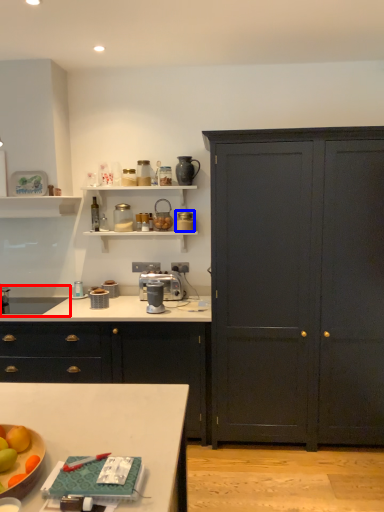
Question: Which point is further to the camera, sink (highlighted by a red box) or appliance (highlighted by a blue box)?

Choices:
 (A) sink
 (B) appliance

Answer: (B)